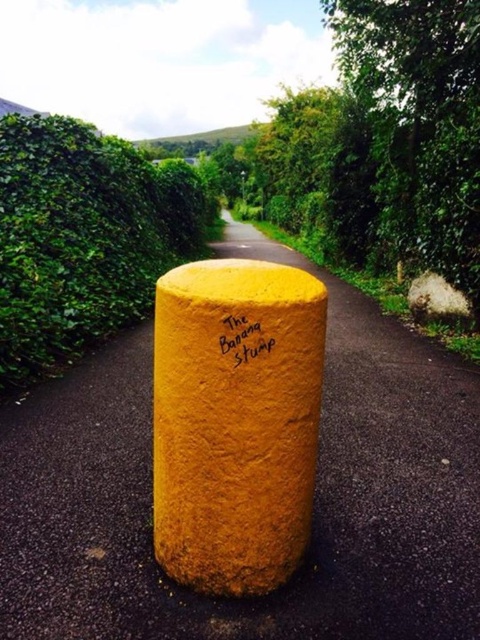
Does yellow textured bollard at center have a greater width compared to yellow matte pole at center?

Indeed, yellow textured bollard at center has a greater width compared to yellow matte pole at center.

Who is shorter, yellow textured bollard at center or yellow matte pole at center?

yellow matte pole at center is shorter.

Between point (47, 387) and point (299, 292), which one is positioned behind?

Point (47, 387)

Locate an element on the screen. Image resolution: width=480 pixels, height=640 pixels. yellow textured bollard at center is located at coordinates (314, 500).

Is yellow textured bollard at center to the right of green leafy hedge at left from the viewer's perspective?

Indeed, yellow textured bollard at center is positioned on the right side of green leafy hedge at left.

Does yellow textured bollard at center have a greater width compared to green leafy hedge at left?

Yes.

Between point (48, 538) and point (155, 241), which one is positioned behind?

Positioned behind is point (155, 241).

The image size is (480, 640). Find the location of `yellow textured bollard at center`. yellow textured bollard at center is located at coordinates (314, 500).

Looking at this image, can you confirm if green leafy hedge at left is wider than yellow matte the banana stump at center?

Yes, green leafy hedge at left is wider than yellow matte the banana stump at center.

Does green leafy hedge at left lie in front of yellow matte the banana stump at center?

No, it is not.

Is point (67, 148) farther from camera compared to point (269, 346)?

That is True.

The width and height of the screenshot is (480, 640). In order to click on green leafy hedge at left in this screenshot , I will do `click(84, 236)`.